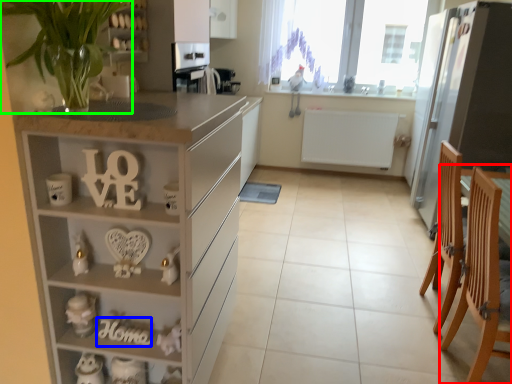
Question: Which object is the farthest from armchair (highlighted by a red box)? Choose among these: alphabet (highlighted by a blue box) or plant (highlighted by a green box).

Choices:
 (A) alphabet
 (B) plant

Answer: (B)